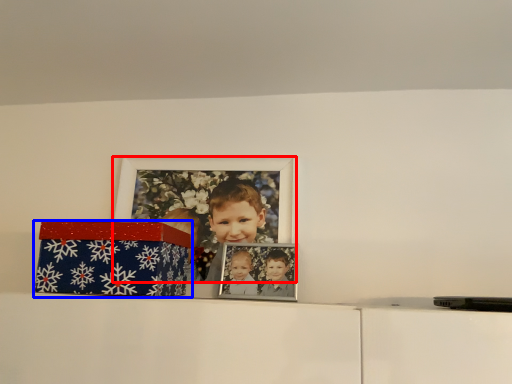
Question: Which object is further to the camera taking this photo, picture frame (highlighted by a red box) or box (highlighted by a blue box)?

Choices:
 (A) picture frame
 (B) box

Answer: (A)